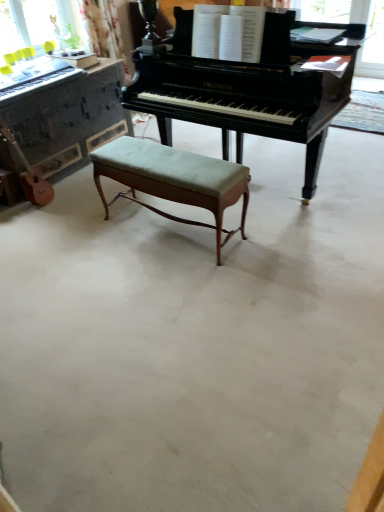
The width and height of the screenshot is (384, 512). I want to click on empty space that is ontop of green fabric stool at center (from a real-world perspective), so click(x=162, y=161).